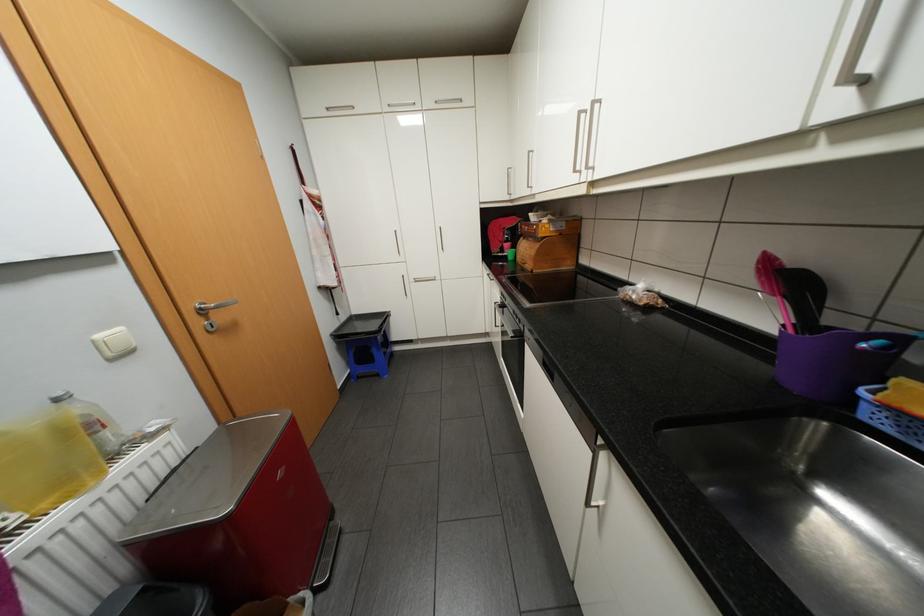
The location [804,297] corresponds to which object?

It refers to a black kitchen spatula.